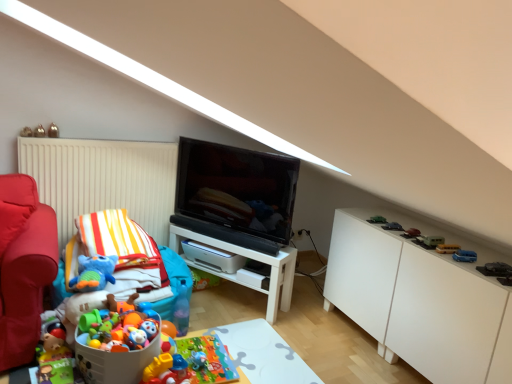
I want to click on vacant position to the left of yellow matte school bus at right, the tenth toy when ordered from left to right, so click(423, 243).